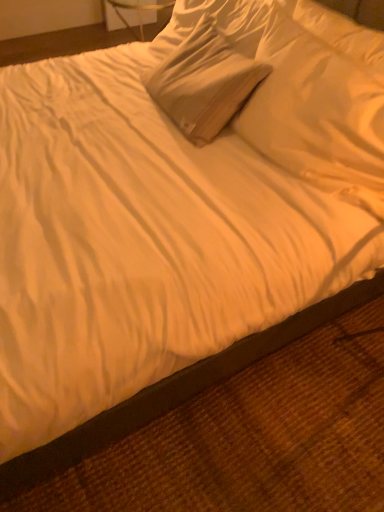
Question: From a real-world perspective, is white soft pillow at upper center, the second pillow in the right-to-left sequence, on white soft pillow at upper center, the 2th pillow viewed from the left?

Choices:
 (A) no
 (B) yes

Answer: (A)

Question: Is the depth of white soft pillow at upper center, the second pillow in the right-to-left sequence, less than that of white soft pillow at upper center, the 2th pillow viewed from the left?

Choices:
 (A) yes
 (B) no

Answer: (B)

Question: Is white soft pillow at upper center, marked as the first pillow in a left-to-right arrangement, far away from white soft pillow at upper center, the 2th pillow viewed from the left?

Choices:
 (A) no
 (B) yes

Answer: (A)

Question: Are white soft pillow at upper center, marked as the first pillow in a left-to-right arrangement, and white soft pillow at upper center, positioned as the 1th pillow in right-to-left order, making contact?

Choices:
 (A) no
 (B) yes

Answer: (A)

Question: Does white soft pillow at upper center, the second pillow in the right-to-left sequence, lie behind white soft pillow at upper center, positioned as the 1th pillow in right-to-left order?

Choices:
 (A) yes
 (B) no

Answer: (A)

Question: Could white soft pillow at upper center, positioned as the 1th pillow in right-to-left order, be considered to be inside white soft pillow at upper center, marked as the first pillow in a left-to-right arrangement?

Choices:
 (A) yes
 (B) no

Answer: (B)

Question: Considering the relative sizes of white soft pillow at upper center, the 2th pillow viewed from the left, and white soft pillow at upper center, the second pillow in the right-to-left sequence, in the image provided, is white soft pillow at upper center, the 2th pillow viewed from the left, wider than white soft pillow at upper center, the second pillow in the right-to-left sequence,?

Choices:
 (A) yes
 (B) no

Answer: (B)

Question: Can you confirm if white soft pillow at upper center, the 2th pillow viewed from the left, is bigger than white soft pillow at upper center, the second pillow in the right-to-left sequence?

Choices:
 (A) yes
 (B) no

Answer: (B)

Question: From a real-world perspective, is white soft pillow at upper center, positioned as the 1th pillow in right-to-left order, located beneath white soft pillow at upper center, the second pillow in the right-to-left sequence?

Choices:
 (A) yes
 (B) no

Answer: (B)

Question: Is white soft pillow at upper center, positioned as the 1th pillow in right-to-left order, shorter than white soft pillow at upper center, the second pillow in the right-to-left sequence?

Choices:
 (A) no
 (B) yes

Answer: (B)

Question: Does white soft pillow at upper center, positioned as the 1th pillow in right-to-left order, have a greater height compared to white soft pillow at upper center, marked as the first pillow in a left-to-right arrangement?

Choices:
 (A) yes
 (B) no

Answer: (B)

Question: From the image's perspective, is white soft pillow at upper center, positioned as the 1th pillow in right-to-left order, on white soft pillow at upper center, marked as the first pillow in a left-to-right arrangement?

Choices:
 (A) yes
 (B) no

Answer: (B)

Question: Is white soft pillow at upper center, marked as the first pillow in a left-to-right arrangement, situated inside white soft pillow at upper center, the 2th pillow viewed from the left, or outside?

Choices:
 (A) outside
 (B) inside

Answer: (A)